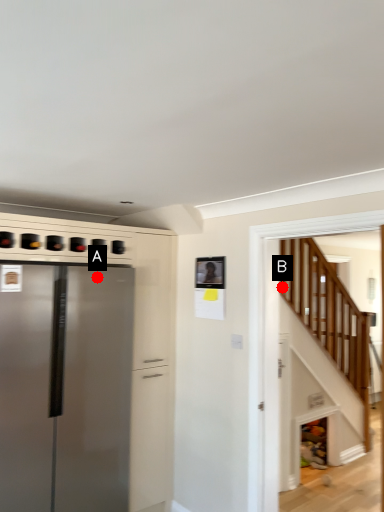
Question: Two points are circled on the image, labeled by A and B beside each circle. Which point is farther to the camera?

Choices:
 (A) A is further
 (B) B is further

Answer: (B)